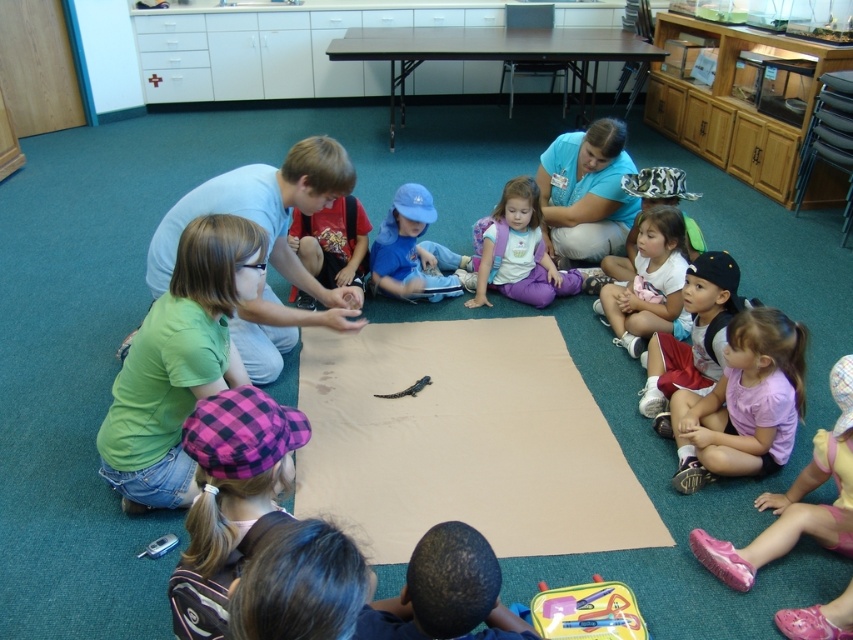
Question: Is purple cotton pants at center positioned behind matte yellow lunchbox at lower center?

Choices:
 (A) no
 (B) yes

Answer: (B)

Question: Is green matte shirt at center bigger than matte red shorts at lower right?

Choices:
 (A) no
 (B) yes

Answer: (B)

Question: Which point appears farthest from the camera in this image?

Choices:
 (A) (534, 221)
 (B) (733, 268)

Answer: (A)

Question: Estimate the real-world distances between objects in this image. Which object is closer to the blue smooth shirt at upper center?

Choices:
 (A) dark brown hair at lower center
 (B) blue fabric hat at center
 (C) purple cotton pants at center

Answer: (C)

Question: Which of the following is the farthest from the observer?

Choices:
 (A) dark brown hair at lower center
 (B) pink cotton shirt at lower right

Answer: (B)

Question: Is dark brown hair at lower center positioned at the back of blue fabric hat at center?

Choices:
 (A) no
 (B) yes

Answer: (A)